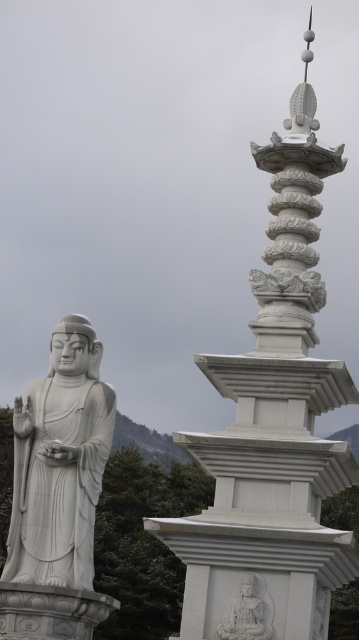
You are standing in front of the two statues in the image. Which statue, the white marble statue at left or the white stone statue at center, is closer to you?

The white marble statue at left is closer to you because it is further to the viewer than the white stone statue at center.

In the scene shown: You are an architect designing a new garden layout and need to place both the white marble statue at left and the white stone statue at center. Based on the image, which statue should be placed higher up on a slope to maintain the original spatial relationship?

The white marble statue at left should be placed higher up on the slope because it is positioned over the white stone statue at center in the original image.